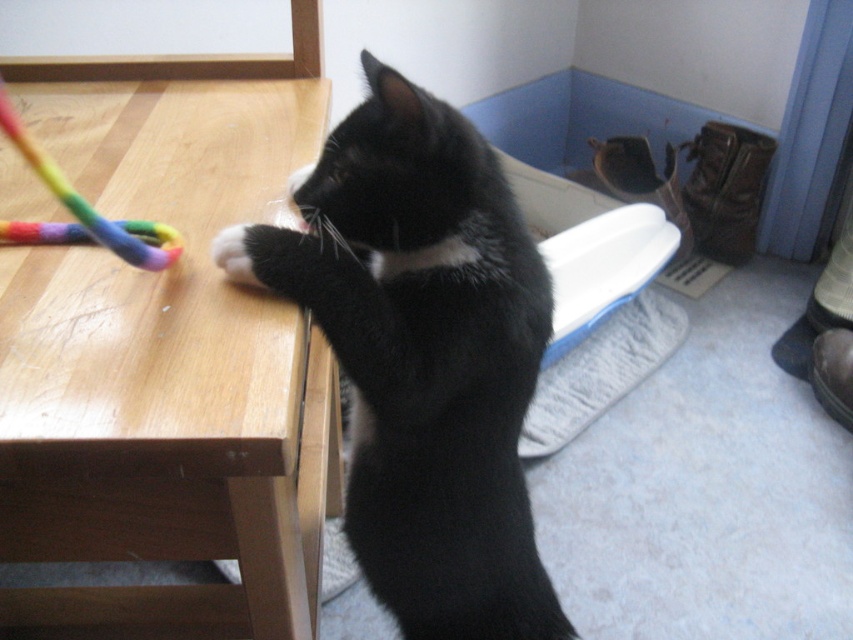
You are a small robot with a height of 30 cm. You want to place a new toy on the wooden table at left and the rainbow fabric toy at left. Which object can you reach to place the new toy on top of it?

The wooden table at left is taller than the rainbow fabric toy at left. Since the robot is 30 cm tall, it can reach the wooden table at left to place the new toy on top of it, but cannot reach the rainbow fabric toy at left because it is shorter.

Based on the photo, you are a cat owner who wants to place a new cat tree in the room. The cat tree is 1.2 meters wide. You see the wooden table at left and the rainbow fabric toy at left in the image. Is there enough space between them to fit the cat tree?

The wooden table at left is to the right of rainbow fabric toy at left, but the distance between them is not specified. Therefore, it is uncertain if the cat tree will fit.